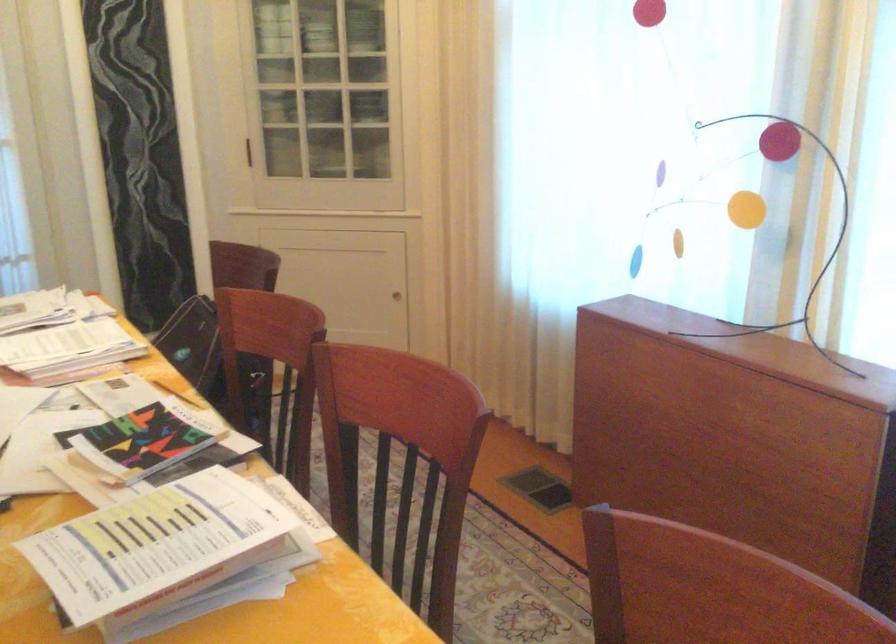
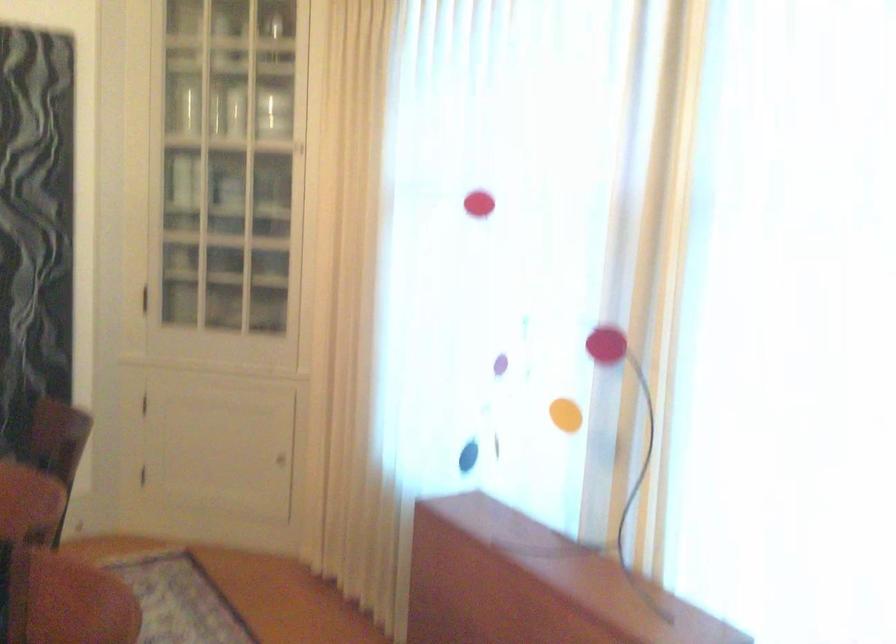
Question: Based on the continuous images, in which direction is the camera rotating? Reply with the corresponding letter.

Choices:
 (A) Left
 (B) Right
 (C) Up
 (D) Down

Answer: (C)